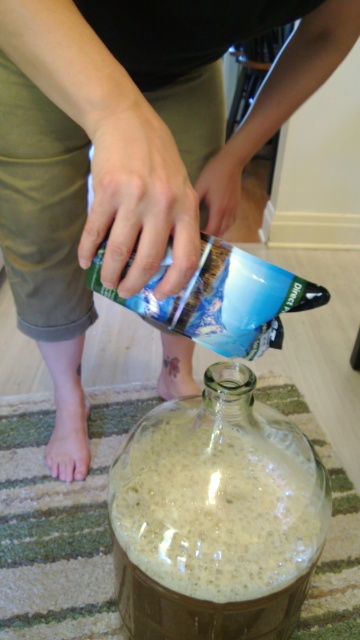
You are standing at the point marked as point [303,528] and want to reach the refrigerator in the background. The path is clear except for a striped rug with earthy tones. If your stride length is 70 centimeters, how many full strides will you need to take to reach the refrigerator?

Since the distance between you and the refrigerator is 59.53 centimeters and each stride is 70 centimeters, you would only need 1 full stride to cover the distance. However, since the distance is less than a full stride, you might not need to take a full step. But if required to take full strides, 1 stride would suffice.

You are a homebrewer trying to monitor the fermentation process. You notice the transparent glass jar at lower center and the pale skin at lower left. Which object is positioned lower in the image?

The transparent glass jar at lower center is positioned below the pale skin at lower left, so it is lower in the image.